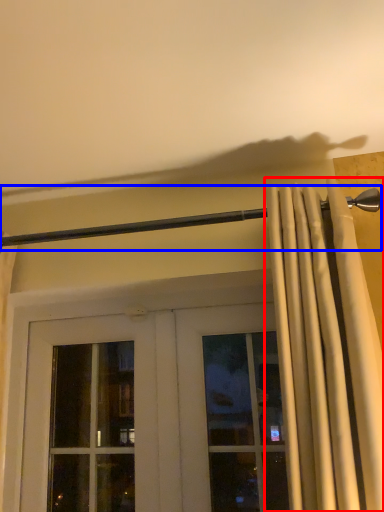
Question: Among these objects, which one is farthest to the camera, curtain (highlighted by a red box) or beam (highlighted by a blue box)?

Choices:
 (A) curtain
 (B) beam

Answer: (B)